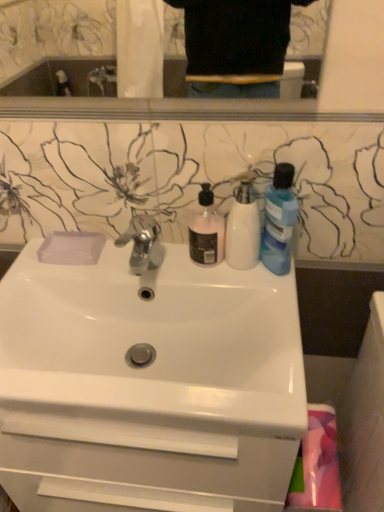
Identify the location of free space to the left of white matte bottle at center, marked as the 2th cleaning product in a left-to-right arrangement. (175, 268).